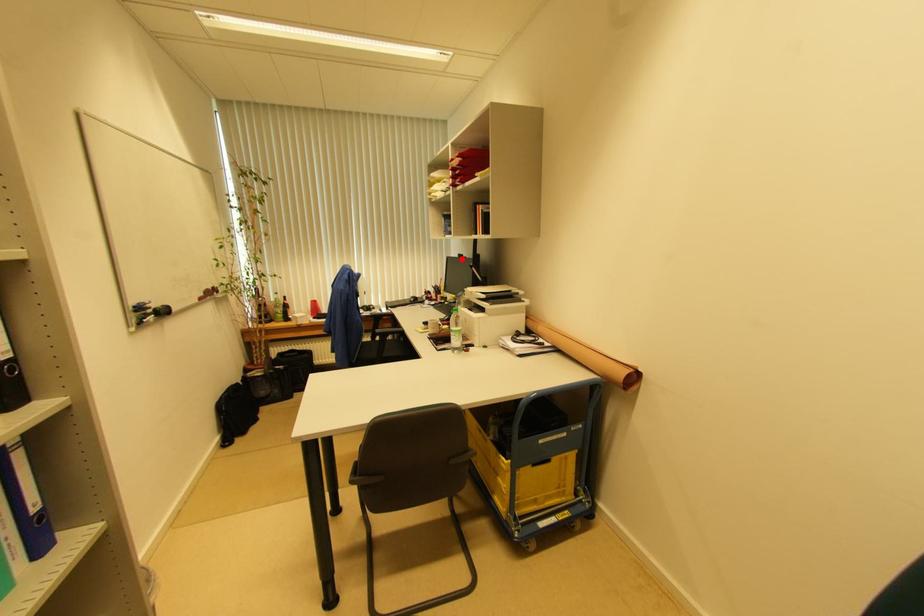
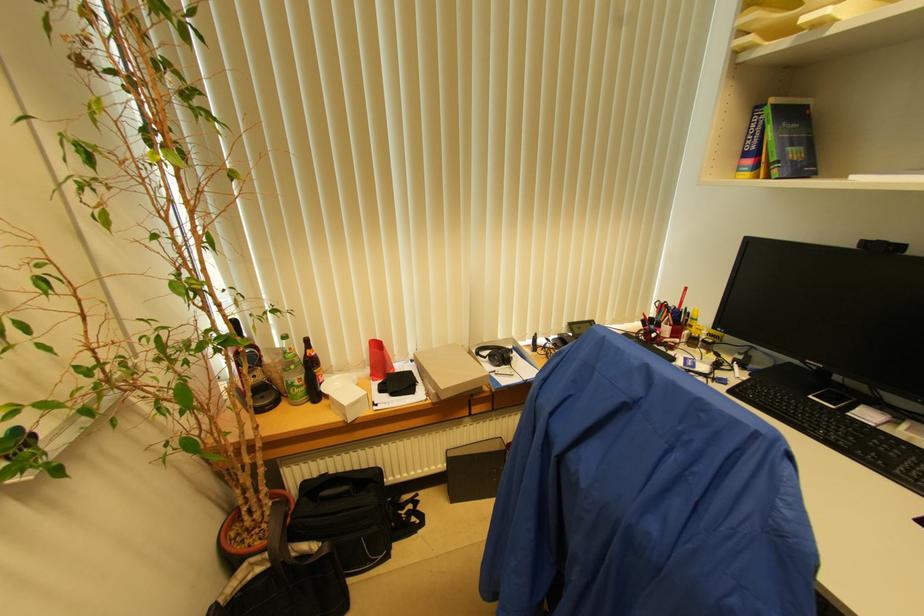
Find the pixel in the second image that matches the highlighted location in the first image.

(882, 251)